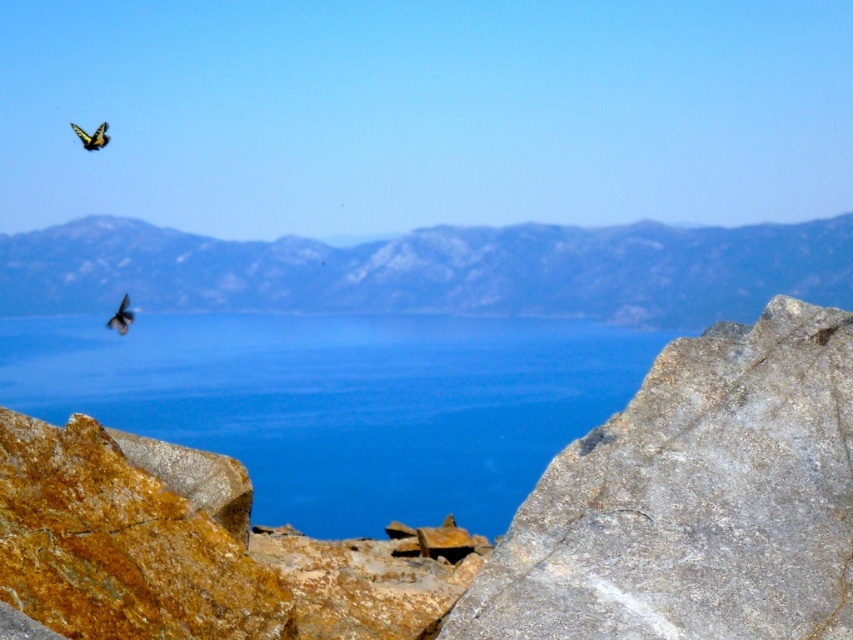
Between blue water at center and shiny black bird at upper left, which one appears on the left side from the viewer's perspective?

shiny black bird at upper left

Does blue water at center appear on the left side of shiny black bird at upper left?

In fact, blue water at center is to the right of shiny black bird at upper left.

Is point (158, 336) less distant than point (125, 324)?

No, (158, 336) is further to viewer.

The image size is (853, 640). In order to click on blue water at center in this screenshot , I will do `click(341, 403)`.

Is blue water at center closer to the viewer compared to gray/rough rock at center-right?

No, it is behind gray/rough rock at center-right.

Does blue water at center appear on the right side of gray/rough rock at center-right?

In fact, blue water at center is to the left of gray/rough rock at center-right.

Is point (144, 328) closer to camera compared to point (814, 353)?

No, (144, 328) is behind (814, 353).

At what (x,y) coordinates should I click in order to perform the action: click on blue water at center. Please return your answer as a coordinate pair (x, y). Looking at the image, I should click on (341, 403).

Between gray/rough rock at center-right and gray rocky mountain at center, which one is positioned lower?

Positioned lower is gray/rough rock at center-right.

Measure the distance between gray/rough rock at center-right and gray rocky mountain at center.

They are 24.16 feet apart.

Describe the element at coordinates (693, 500) in the screenshot. I see `gray/rough rock at center-right` at that location.

The image size is (853, 640). I want to click on gray/rough rock at center-right, so click(693, 500).